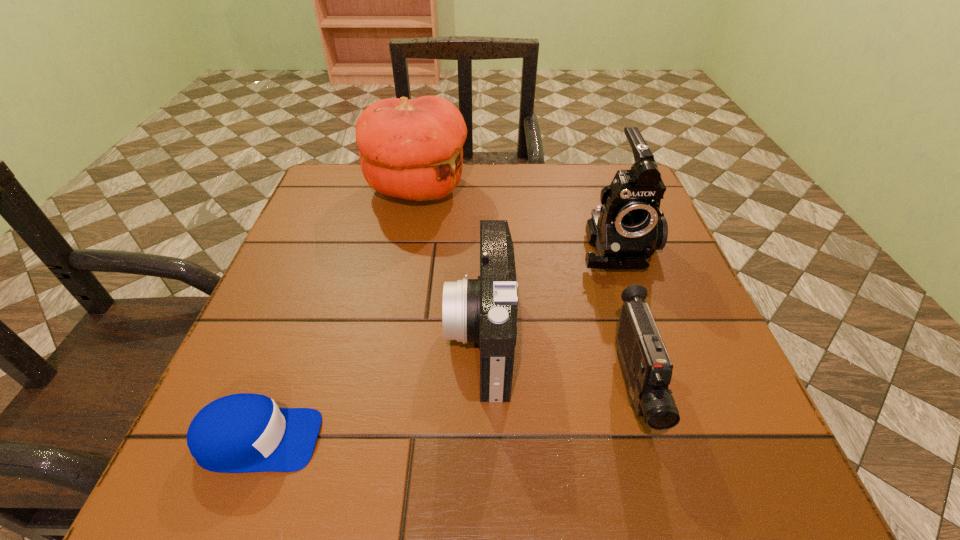
Where is `object present at the near left corner`? This screenshot has height=540, width=960. object present at the near left corner is located at coordinates (239, 433).

The image size is (960, 540). Find the location of `object located in the near right corner section of the desktop`. object located in the near right corner section of the desktop is located at coordinates (647, 369).

Identify the location of vacant position at the far edge of the desktop. The image size is (960, 540). (475, 192).

The width and height of the screenshot is (960, 540). I want to click on vacant area at the near edge of the desktop, so click(619, 436).

The image size is (960, 540). I want to click on free region at the left edge of the desktop, so click(243, 363).

You are a GUI agent. You are given a task and a screenshot of the screen. Output one action in this format:
    pyautogui.click(x=<x>, y=<y>)
    Task: Click on the free space at the right edge of the desktop
    The height and width of the screenshot is (540, 960).
    Given the screenshot: What is the action you would take?
    pyautogui.click(x=711, y=340)

In the image, there is a desktop. Where is `blank space at the far left corner`? The height and width of the screenshot is (540, 960). blank space at the far left corner is located at coordinates (329, 197).

Image resolution: width=960 pixels, height=540 pixels. What are the coordinates of `free region at the far right corner` in the screenshot? It's located at (589, 168).

At what (x,y) coordinates should I click in order to perform the action: click on vacant space at the near right corner of the desktop. Please return your answer as a coordinate pair (x, y). The image size is (960, 540). Looking at the image, I should click on (738, 438).

Where is `free point between the shortest camcorder and the shortest object`? free point between the shortest camcorder and the shortest object is located at coordinates pyautogui.click(x=445, y=414).